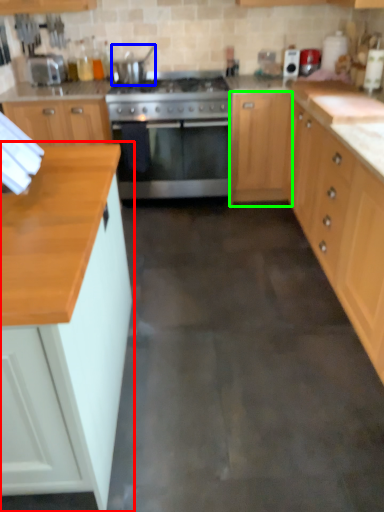
Question: Considering the real-world distances, which object is farthest from cabinetry (highlighted by a red box)? appliance (highlighted by a blue box) or cabinetry (highlighted by a green box)?

Choices:
 (A) appliance
 (B) cabinetry

Answer: (A)